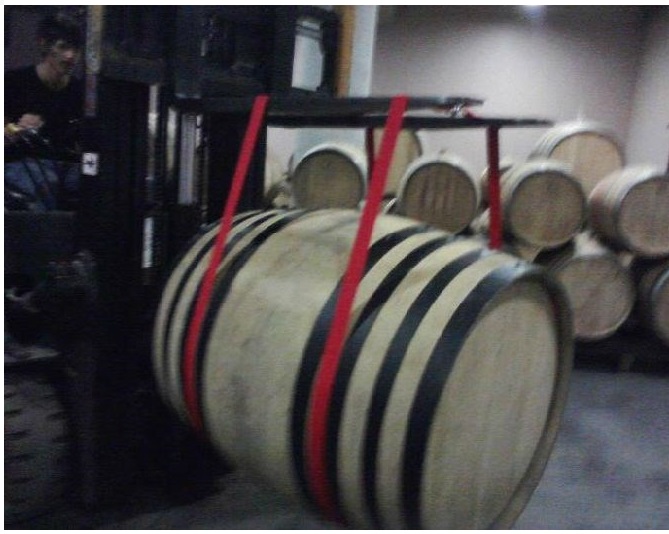
The image size is (669, 534). I want to click on floor, so click(x=631, y=457).